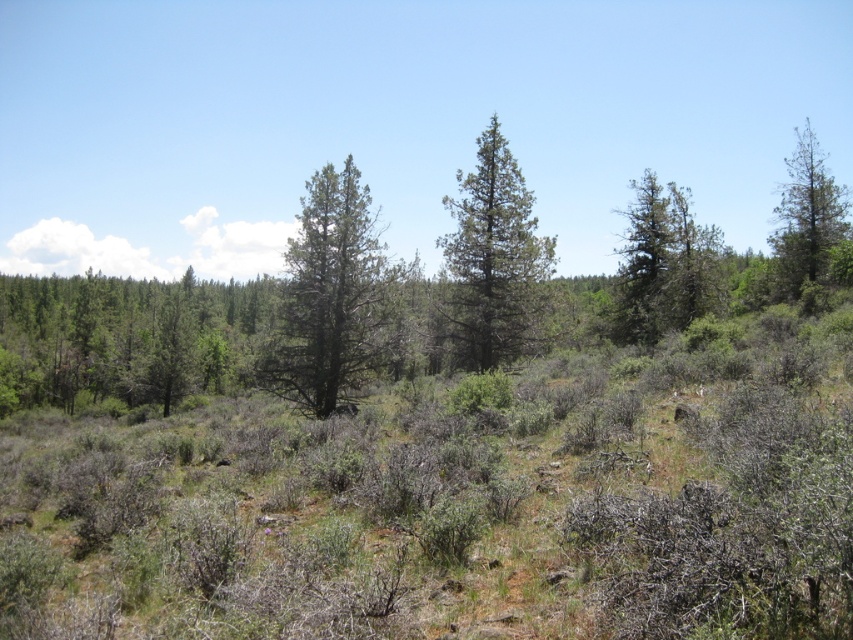
Question: Can you confirm if green needle-like at center is positioned to the right of green needle-like at upper right?

Choices:
 (A) no
 (B) yes

Answer: (A)

Question: From the image, what is the correct spatial relationship of green matte tree at left in relation to green needle-like tree at center?

Choices:
 (A) right
 (B) left

Answer: (B)

Question: Which object is the farthest from the green matte tree at left?

Choices:
 (A) green textured tree at right
 (B) green needle-like at center
 (C) green needle-like at upper right

Answer: (C)

Question: Is the position of green matte tree at left more distant than that of green needle-like tree at right?

Choices:
 (A) yes
 (B) no

Answer: (B)

Question: Among these points, which one is nearest to the camera?

Choices:
 (A) (672, 220)
 (B) (490, 280)
 (C) (792, 166)

Answer: (B)

Question: Which of the following is the farthest from the observer?

Choices:
 (A) (660, 230)
 (B) (672, 204)
 (C) (523, 262)

Answer: (B)